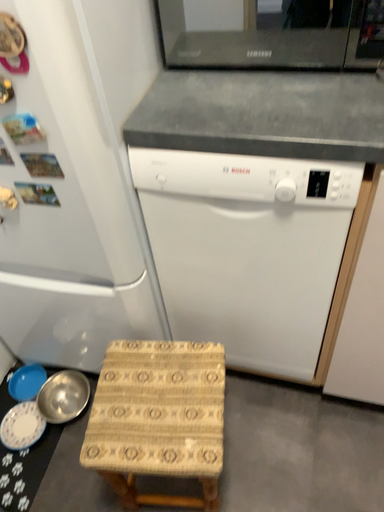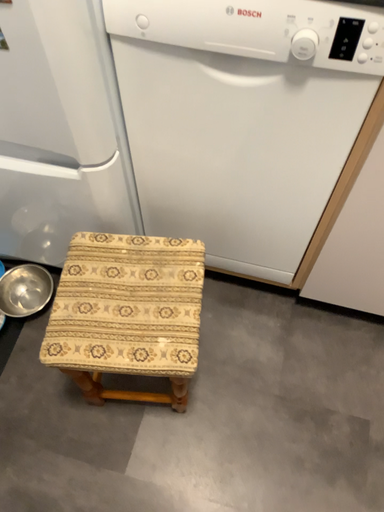
Question: Which way did the camera rotate in the video?

Choices:
 (A) rotated upward
 (B) rotated downward

Answer: (B)